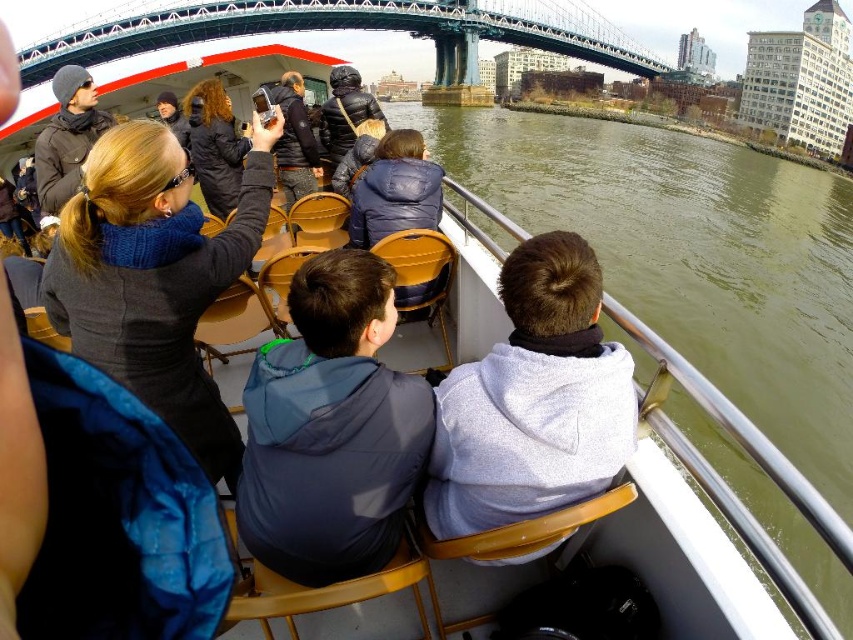
Question: In this image, where is greenish water at center located relative to brushed steel bridge at upper center?

Choices:
 (A) below
 (B) above

Answer: (A)

Question: Which object is closer to the camera taking this photo?

Choices:
 (A) brushed steel bridge at upper center
 (B) matte black jacket at left
 (C) dark blue hoodie at center
 (D) black fuzzy jacket at upper center

Answer: (C)

Question: Which object is positioned closest to the greenish water at center?

Choices:
 (A) dark blue hoodie at center
 (B) brushed steel bridge at upper center
 (C) black fuzzy jacket at upper center
 (D) gray fleece jacket at center

Answer: (D)

Question: Does dark gray sweater at upper left appear under brushed steel bridge at upper center?

Choices:
 (A) no
 (B) yes

Answer: (B)

Question: Which of the following is the closest to the observer?

Choices:
 (A) brushed steel bridge at upper center
 (B) dark blue hoodie at center
 (C) dark blue jacket at center
 (D) gray fleece jacket at center

Answer: (B)

Question: Is dark blue hoodie at center in front of black fuzzy jacket at upper center?

Choices:
 (A) no
 (B) yes

Answer: (B)